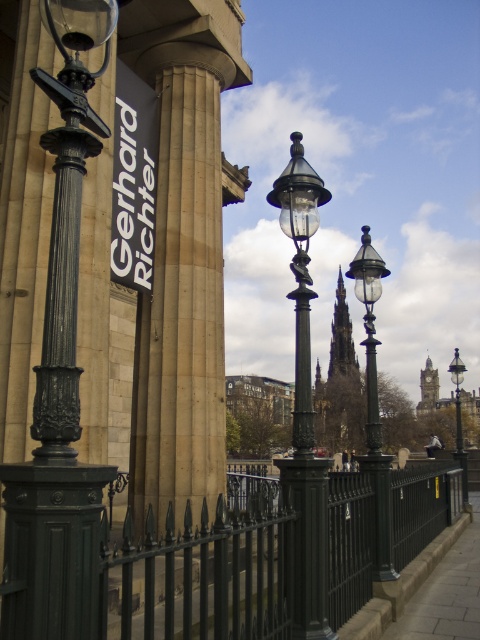
Between point (295, 548) and point (127, 173), which one is positioned behind?

The point (127, 173) is more distant.

Image resolution: width=480 pixels, height=640 pixels. What do you see at coordinates (303, 403) in the screenshot? I see `polished brass street light at center` at bounding box center [303, 403].

Who is more forward, (305, 186) or (132, 230)?

Positioned in front is point (305, 186).

Identify the location of polished brass street light at center. (303, 403).

Is point (175, 196) positioned before point (113, 257)?

No, it is behind (113, 257).

The height and width of the screenshot is (640, 480). In order to click on beige stone column at center in this screenshot , I will do `click(181, 292)`.

In order to click on black wrought iron fence at lower center in this screenshot , I will do [206, 573].

Locate an element on the screen. black wrought iron fence at lower center is located at coordinates (206, 573).